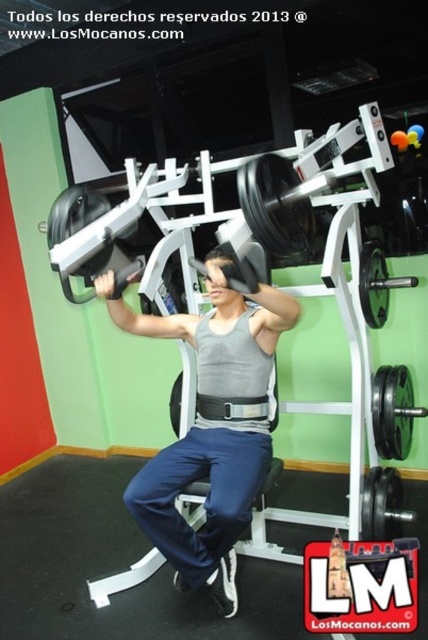
Question: Is gray matte tank top at center to the left of black rubber barbell at center from the viewer's perspective?

Choices:
 (A) no
 (B) yes

Answer: (B)

Question: Can you confirm if gray matte tank top at center is smaller than black rubber barbell at center?

Choices:
 (A) no
 (B) yes

Answer: (A)

Question: Among these objects, which one is farthest from the camera?

Choices:
 (A) gray matte tank top at center
 (B) black rubber barbell at center

Answer: (B)

Question: Which point appears farthest from the camera in this image?

Choices:
 (A) (175, 403)
 (B) (208, 388)

Answer: (A)

Question: Does gray matte tank top at center come behind black rubber barbell at center?

Choices:
 (A) yes
 (B) no

Answer: (B)